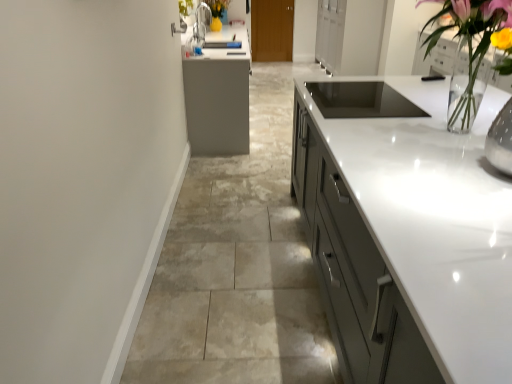
How much space does brown wood door at center, which appears as the 2th cabinetry when viewed from the front, occupy vertically?

It is 3.86 feet.

What do you see at coordinates (434, 221) in the screenshot?
I see `matte gray cabinetry at center, marked as the second cabinetry in a back-to-front arrangement` at bounding box center [434, 221].

Where is `brown wood door at center, which is the 2th cabinetry in bottom-to-top order`? This screenshot has height=384, width=512. brown wood door at center, which is the 2th cabinetry in bottom-to-top order is located at coordinates (272, 30).

Which is more to the right, clear glass vase at upper right or matte gray cabinetry at center, the 1th cabinetry from the bottom?

matte gray cabinetry at center, the 1th cabinetry from the bottom.

From a real-world perspective, is clear glass vase at upper right on matte gray cabinetry at center, the 1th cabinetry from the bottom?

Yes, from a real-world perspective, clear glass vase at upper right is on top of matte gray cabinetry at center, the 1th cabinetry from the bottom.

Identify the location of floral arrangement above the matte gray cabinetry at center, the 1th cabinetry from the bottom (from a real-world perspective). This screenshot has width=512, height=384. (469, 43).

Considering the points (272, 54) and (476, 27), which point is in front, point (272, 54) or point (476, 27)?

The point (476, 27) is closer.

Does brown wood door at center, which is the 2th cabinetry in bottom-to-top order, lie behind clear glass vase at upper right?

Yes, the depth of brown wood door at center, which is the 2th cabinetry in bottom-to-top order, is greater than that of clear glass vase at upper right.

Are brown wood door at center, the 1th cabinetry positioned from the back, and clear glass vase at upper right far apart?

Yes.

Is brown wood door at center, which is the 2th cabinetry in bottom-to-top order, to the right of clear glass vase at upper right from the viewer's perspective?

In fact, brown wood door at center, which is the 2th cabinetry in bottom-to-top order, is to the left of clear glass vase at upper right.

Is matte gray cabinetry at center, which appears as the 2th cabinetry when viewed from the top, behind brown wood door at center, which is the 2th cabinetry in bottom-to-top order?

No.

From the image's perspective, which one is positioned higher, matte gray cabinetry at center, marked as the second cabinetry in a back-to-front arrangement, or brown wood door at center, which appears as the 2th cabinetry when viewed from the front?

brown wood door at center, which appears as the 2th cabinetry when viewed from the front, from the image's perspective.

From a real-world perspective, is matte gray cabinetry at center, marked as the second cabinetry in a back-to-front arrangement, physically above brown wood door at center, which appears as the 2th cabinetry when viewed from the front?

No, from a real-world perspective, matte gray cabinetry at center, marked as the second cabinetry in a back-to-front arrangement, is not on top of brown wood door at center, which appears as the 2th cabinetry when viewed from the front.

Does brown wood door at center, the 1th cabinetry positioned from the back, have a lesser width compared to matte gray cabinetry at center, the 1th cabinetry from the bottom?

Indeed, brown wood door at center, the 1th cabinetry positioned from the back, has a lesser width compared to matte gray cabinetry at center, the 1th cabinetry from the bottom.

Which object is more forward, brown wood door at center, the 1th cabinetry positioned from the back, or matte gray cabinetry at center, the 1th cabinetry from the bottom?

matte gray cabinetry at center, the 1th cabinetry from the bottom, is in front.

Would you say brown wood door at center, the 1th cabinetry positioned from the back, is outside matte gray cabinetry at center, which appears as the 2th cabinetry when viewed from the top?

Yes, brown wood door at center, the 1th cabinetry positioned from the back, is outside of matte gray cabinetry at center, which appears as the 2th cabinetry when viewed from the top.

From a real-world perspective, which object rests below the other?

From a 3D spatial view, matte gray cabinetry at center, marked as the second cabinetry in a back-to-front arrangement, is below.

Looking at the image, does clear glass vase at upper right seem bigger or smaller compared to brown wood door at center, which is the 2th cabinetry in bottom-to-top order?

Considering their sizes, clear glass vase at upper right takes up more space than brown wood door at center, which is the 2th cabinetry in bottom-to-top order.

Does clear glass vase at upper right have a lesser height compared to brown wood door at center, which appears as the 2th cabinetry when viewed from the front?

Yes, clear glass vase at upper right is shorter than brown wood door at center, which appears as the 2th cabinetry when viewed from the front.

Is clear glass vase at upper right looking in the opposite direction of brown wood door at center, which is the 2th cabinetry in bottom-to-top order?

clear glass vase at upper right is not turned away from brown wood door at center, which is the 2th cabinetry in bottom-to-top order.

From a real-world perspective, is clear glass vase at upper right physically located above or below brown wood door at center, the 1th cabinetry positioned from the back?

Clearly, from a real-world perspective, clear glass vase at upper right is above brown wood door at center, the 1th cabinetry positioned from the back.

Between matte gray cabinetry at center, marked as the second cabinetry in a back-to-front arrangement, and clear glass vase at upper right, which one has less height?

Standing shorter between the two is matte gray cabinetry at center, marked as the second cabinetry in a back-to-front arrangement.

Are matte gray cabinetry at center, marked as the second cabinetry in a back-to-front arrangement, and clear glass vase at upper right making contact?

They are not placed beside each other.

In the scene shown: Is matte gray cabinetry at center, which appears as the 2th cabinetry when viewed from the top, looking in the opposite direction of clear glass vase at upper right?

matte gray cabinetry at center, which appears as the 2th cabinetry when viewed from the top, is not turned away from clear glass vase at upper right.

At what (x,y) coordinates should I click in order to perform the action: click on floral arrangement located in front of the matte gray cabinetry at center, acting as the first cabinetry starting from the front. Please return your answer as a coordinate pair (x, y). Looking at the image, I should click on (469, 43).

This screenshot has width=512, height=384. Find the location of `the 2nd cabinetry above when counting from the clear glass vase at upper right (from the image's perspective)`. the 2nd cabinetry above when counting from the clear glass vase at upper right (from the image's perspective) is located at coordinates (272, 30).

From the image, which object appears to be farther from matte gray cabinetry at center, the 1th cabinetry from the bottom, brown wood door at center, positioned as the first cabinetry in top-to-bottom order, or clear glass vase at upper right?

brown wood door at center, positioned as the first cabinetry in top-to-bottom order, is further to matte gray cabinetry at center, the 1th cabinetry from the bottom.

When comparing their distances from clear glass vase at upper right, does matte gray cabinetry at center, marked as the second cabinetry in a back-to-front arrangement, or brown wood door at center, positioned as the first cabinetry in top-to-bottom order, seem closer?

matte gray cabinetry at center, marked as the second cabinetry in a back-to-front arrangement.

From the image, which object appears to be farther from clear glass vase at upper right, brown wood door at center, which appears as the 2th cabinetry when viewed from the front, or matte gray cabinetry at center, acting as the first cabinetry starting from the front?

brown wood door at center, which appears as the 2th cabinetry when viewed from the front, lies further to clear glass vase at upper right than the other object.

When comparing their distances from brown wood door at center, positioned as the first cabinetry in top-to-bottom order, does clear glass vase at upper right or matte gray cabinetry at center, marked as the second cabinetry in a back-to-front arrangement, seem further?

Among the two, clear glass vase at upper right is located further to brown wood door at center, positioned as the first cabinetry in top-to-bottom order.

When comparing their distances from brown wood door at center, positioned as the first cabinetry in top-to-bottom order, does matte gray cabinetry at center, the 1th cabinetry from the bottom, or clear glass vase at upper right seem further?

Based on the image, clear glass vase at upper right appears to be further to brown wood door at center, positioned as the first cabinetry in top-to-bottom order.

Which object lies nearer to the anchor point matte gray cabinetry at center, marked as the second cabinetry in a back-to-front arrangement, clear glass vase at upper right or brown wood door at center, which is the 2th cabinetry in bottom-to-top order?

The object closer to matte gray cabinetry at center, marked as the second cabinetry in a back-to-front arrangement, is clear glass vase at upper right.

The image size is (512, 384). In order to click on cabinetry between clear glass vase at upper right and brown wood door at center, which is the 2th cabinetry in bottom-to-top order, in the front-back direction in this screenshot , I will do `click(434, 221)`.